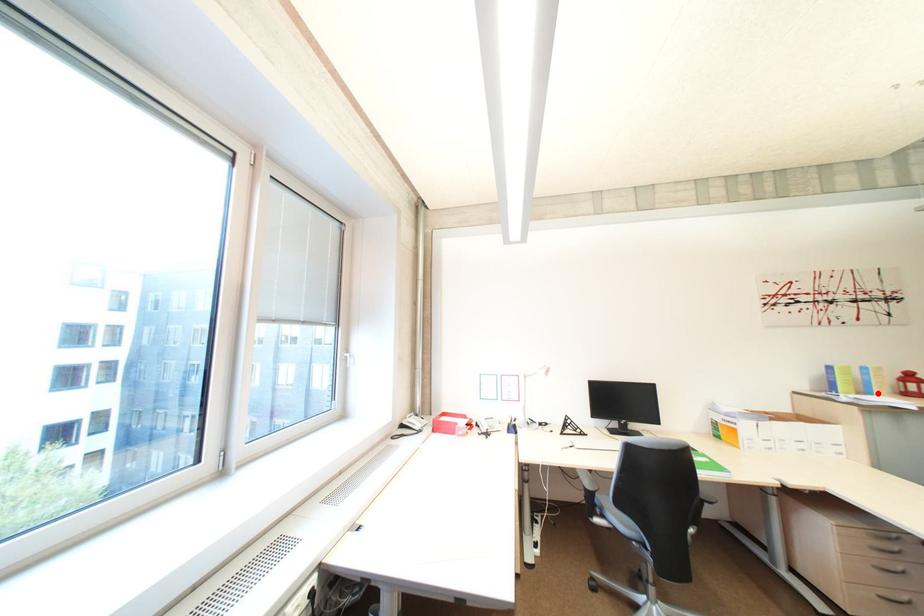
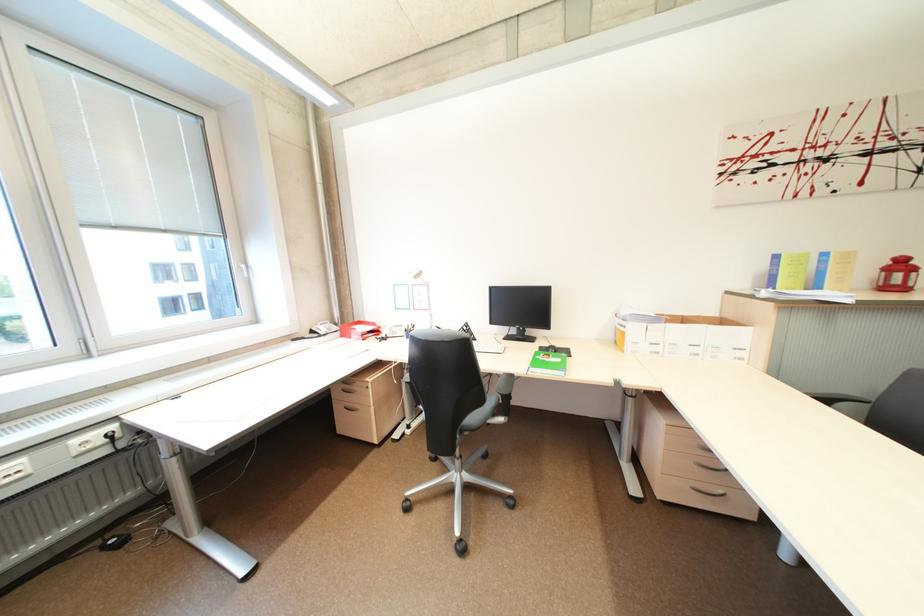
Question: I am providing you with two images of the same scene from different viewpoints. Given a red point in image1, look at the same physical point in image2. Is it:

Choices:
 (A) Closer to the viewpoint
 (B) Farther from the viewpoint

Answer: (B)